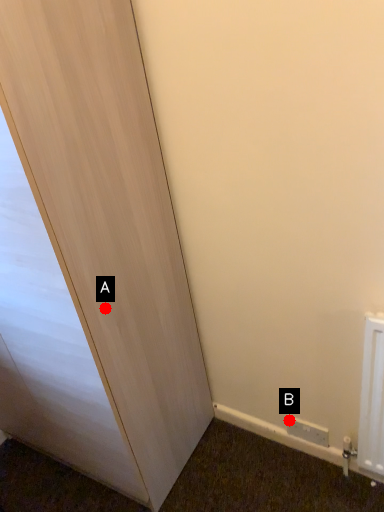
Question: Two points are circled on the image, labeled by A and B beside each circle. Which point is further to the camera?

Choices:
 (A) A is further
 (B) B is further

Answer: (B)